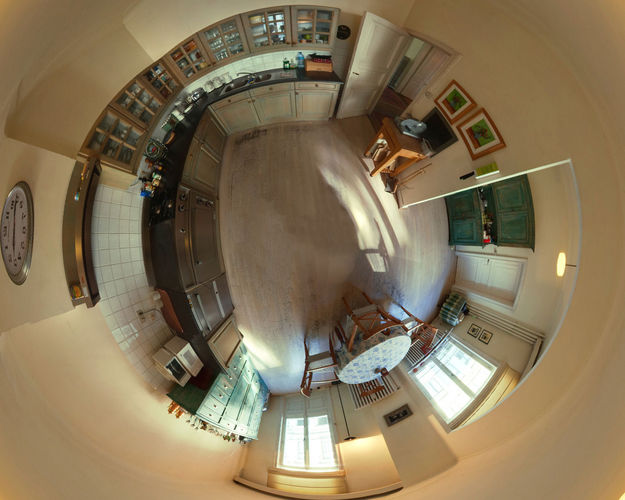
Where is `light`? light is located at coordinates (559, 261).